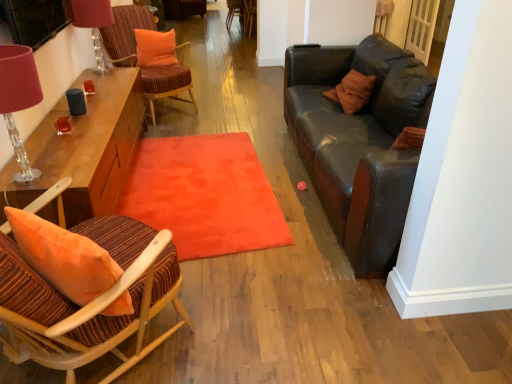
Question: Can you see wooden armchair at center, positioned as the first armchair in right-to-left order, touching wooden armchair at center, acting as the second armchair starting from the right?

Choices:
 (A) yes
 (B) no

Answer: (B)

Question: Does wooden armchair at center, which is the 2th armchair from left to right, lie in front of wooden armchair at center, acting as the second armchair starting from the right?

Choices:
 (A) no
 (B) yes

Answer: (B)

Question: Is the depth of wooden armchair at center, positioned as the first armchair in right-to-left order, greater than that of wooden armchair at center, arranged as the first armchair when viewed from the left?

Choices:
 (A) yes
 (B) no

Answer: (B)

Question: Is wooden armchair at center, positioned as the first armchair in right-to-left order, at the right side of wooden armchair at center, acting as the second armchair starting from the right?

Choices:
 (A) yes
 (B) no

Answer: (A)

Question: Is wooden armchair at center, which is the 2th armchair from left to right, wider than wooden armchair at center, acting as the second armchair starting from the right?

Choices:
 (A) yes
 (B) no

Answer: (A)

Question: From a real-world perspective, relative to velvet orange chair at upper left, the second chair viewed from the top, is matte pink lampshade at left, the 2th table lamp in the top-to-bottom sequence, vertically above or below?

Choices:
 (A) below
 (B) above

Answer: (B)

Question: Is matte pink lampshade at left, the first table lamp positioned from the front, wider or thinner than velvet orange chair at upper left, the second chair positioned from the front?

Choices:
 (A) thin
 (B) wide

Answer: (A)

Question: From the image's perspective, relative to velvet orange chair at upper left, placed as the second chair when sorted from back to front, is matte pink lampshade at left, the 2th table lamp in the top-to-bottom sequence, above or below?

Choices:
 (A) above
 (B) below

Answer: (B)

Question: From their relative heights in the image, would you say matte pink lampshade at left, the 2th table lamp in the top-to-bottom sequence, is taller or shorter than velvet orange chair at upper left, placed as the second chair when sorted from back to front?

Choices:
 (A) tall
 (B) short

Answer: (B)

Question: From the image's perspective, is matte pink lampshade at upper left, which appears as the second table lamp when ordered from the bottom, positioned above or below wooden armchair at center, which is the 2th armchair from left to right?

Choices:
 (A) above
 (B) below

Answer: (B)

Question: Considering the positions of matte pink lampshade at upper left, which appears as the second table lamp when ordered from the bottom, and wooden armchair at center, which is the 2th armchair from left to right, in the image, is matte pink lampshade at upper left, which appears as the second table lamp when ordered from the bottom, bigger or smaller than wooden armchair at center, which is the 2th armchair from left to right,?

Choices:
 (A) small
 (B) big

Answer: (A)

Question: Is matte pink lampshade at upper left, the second table lamp from the front, to the left or to the right of wooden armchair at center, positioned as the first armchair in right-to-left order, in the image?

Choices:
 (A) right
 (B) left

Answer: (B)

Question: Is matte pink lampshade at upper left, the first table lamp from the back, in front of or behind wooden armchair at center, which is the 2th armchair from left to right, in the image?

Choices:
 (A) front
 (B) behind

Answer: (A)

Question: From their relative heights in the image, would you say orange fabric pillow at upper center is taller or shorter than wooden armchair at center, which is the 2th armchair from left to right?

Choices:
 (A) tall
 (B) short

Answer: (B)

Question: Is orange fabric pillow at upper center inside the boundaries of wooden armchair at center, which is the 2th armchair from left to right, or outside?

Choices:
 (A) inside
 (B) outside

Answer: (B)